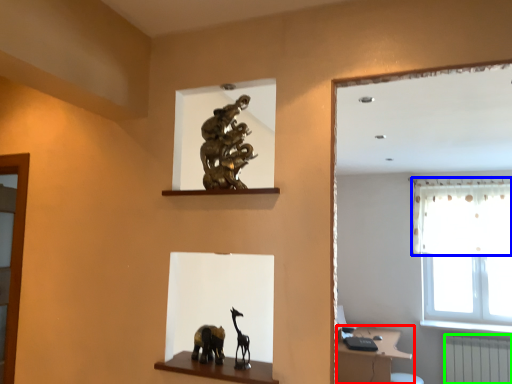
Question: Which object is positioned closest to vanity (highlighted by a red box)? Select from curtain (highlighted by a blue box) and radiator (highlighted by a green box).

Choices:
 (A) curtain
 (B) radiator

Answer: (B)